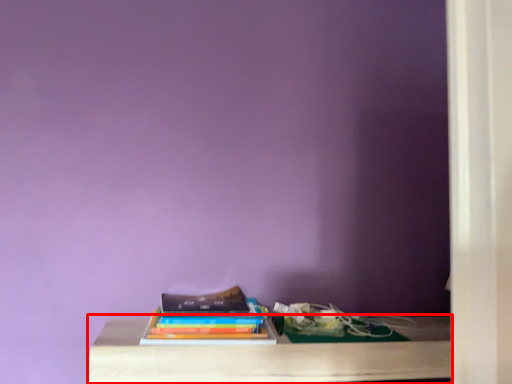
Question: From the image's perspective, where is table (annotated by the red box) located in relation to book in the image?

Choices:
 (A) below
 (B) above

Answer: (A)